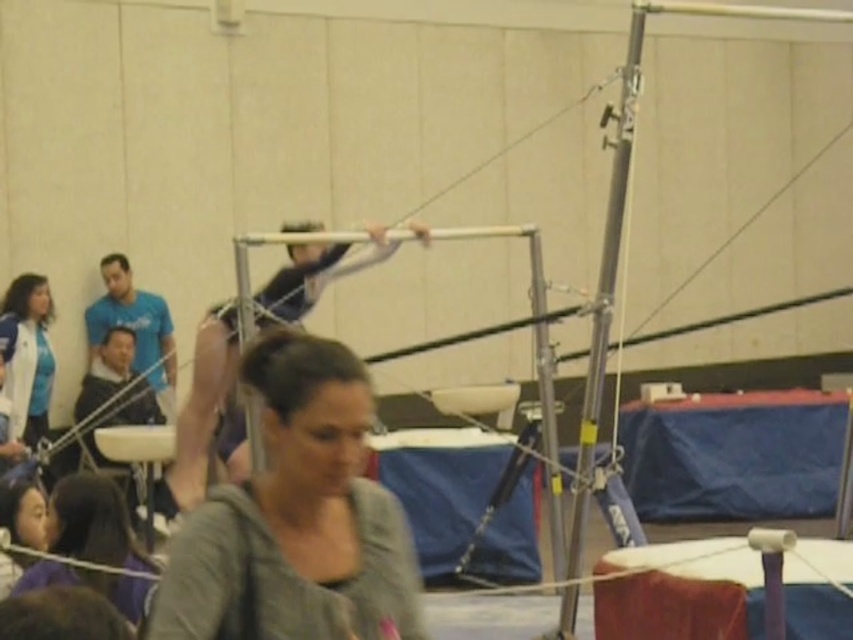
Question: Which point is farther to the camera?

Choices:
 (A) (30, 438)
 (B) (285, 568)
 (C) (318, 243)
 (D) (653, 621)

Answer: (A)

Question: Which object is positioned farthest from the smooth purple mat at center?

Choices:
 (A) white jacket at left
 (B) wooden gymnastics bar at center
 (C) metallic silver pole at upper center

Answer: (A)

Question: From the image, what is the correct spatial relationship of metallic silver pole at upper center in relation to matte purple shirt at lower left?

Choices:
 (A) left
 (B) right

Answer: (B)

Question: Which of the following is the farthest from the observer?

Choices:
 (A) (25, 396)
 (B) (755, 554)
 (C) (91, 570)

Answer: (A)

Question: Is metallic silver pole at upper center further to camera compared to matte purple shirt at lower left?

Choices:
 (A) no
 (B) yes

Answer: (B)

Question: From the image, what is the correct spatial relationship of metallic silver pole at upper center in relation to white jacket at left?

Choices:
 (A) right
 (B) left

Answer: (A)